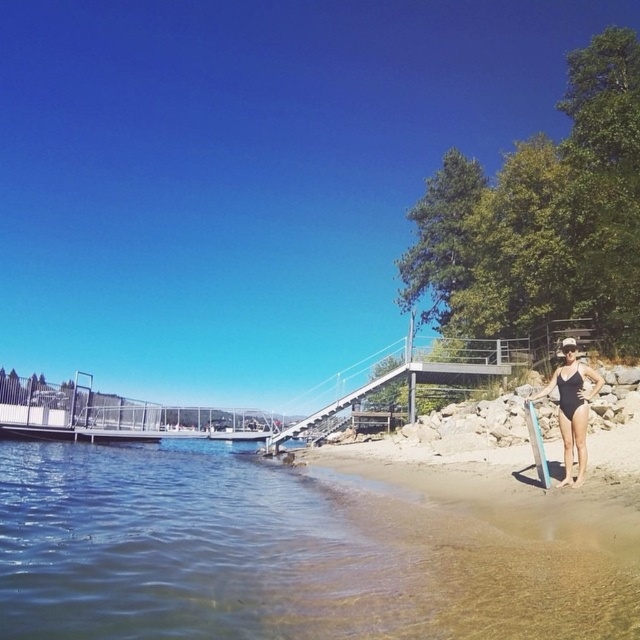
Question: Among these objects, which one is nearest to the camera?

Choices:
 (A) clear blue water at lower left
 (B) black matte swimsuit at lower right
 (C) blue plastic surfboard at right

Answer: (A)

Question: Does clear blue water at lower left come behind black matte swimsuit at lower right?

Choices:
 (A) yes
 (B) no

Answer: (B)

Question: Which of the following is the farthest from the observer?

Choices:
 (A) black matte swimsuit at lower right
 (B) blue plastic surfboard at right
 (C) clear blue water at lower left

Answer: (B)

Question: Does black matte swimsuit at lower right appear on the right side of blue plastic surfboard at right?

Choices:
 (A) yes
 (B) no

Answer: (A)

Question: Considering the relative positions of clear blue water at lower left and black matte swimsuit at lower right in the image provided, where is clear blue water at lower left located with respect to black matte swimsuit at lower right?

Choices:
 (A) right
 (B) left

Answer: (B)

Question: Considering the real-world distances, which object is farthest from the black matte swimsuit at lower right?

Choices:
 (A) clear blue water at lower left
 (B) blue plastic surfboard at right

Answer: (A)